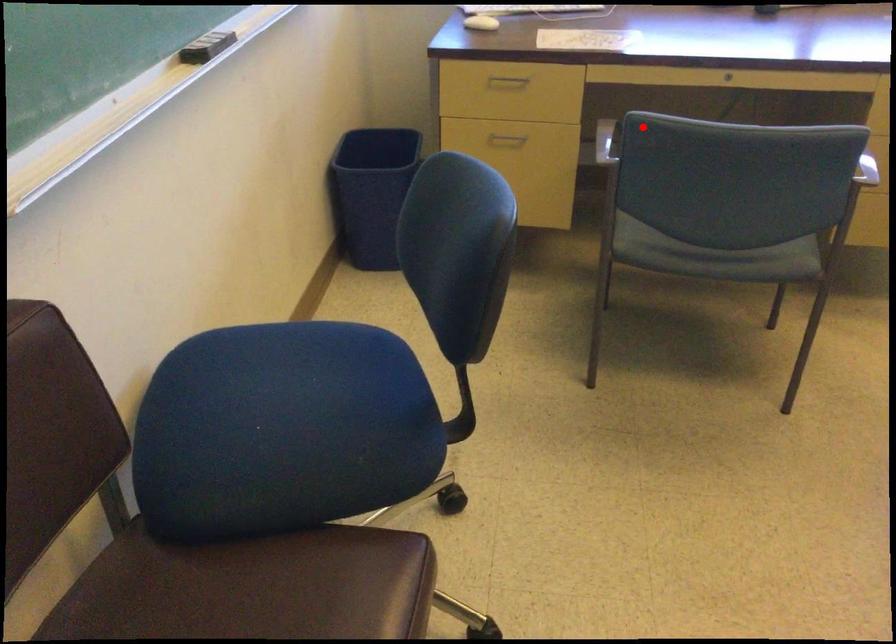
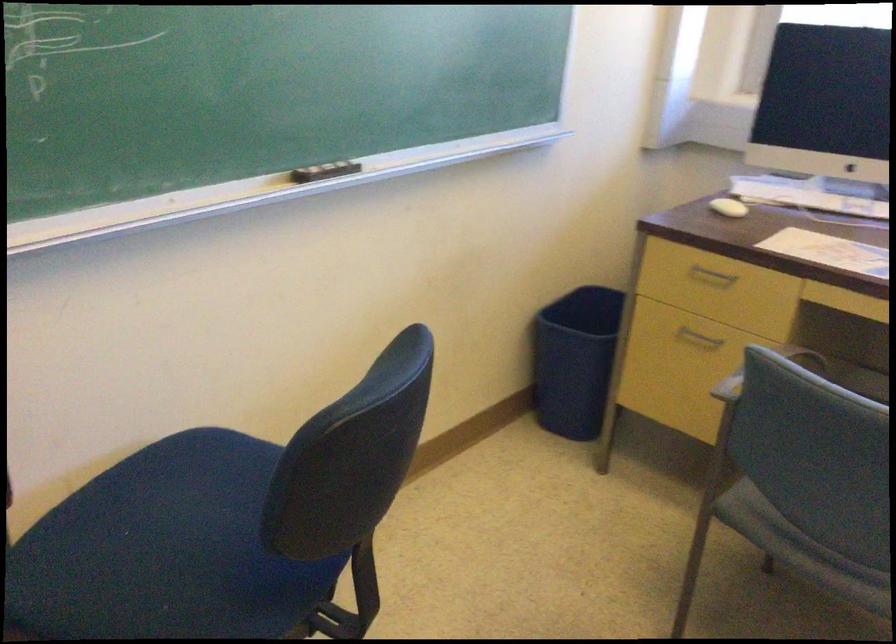
Question: I am providing you with two images of the same scene from different viewpoints. A red point is shown in image1. For the corresponding object point in image2, is it positioned nearer or farther from the camera?

Choices:
 (A) Nearer
 (B) Farther

Answer: (A)